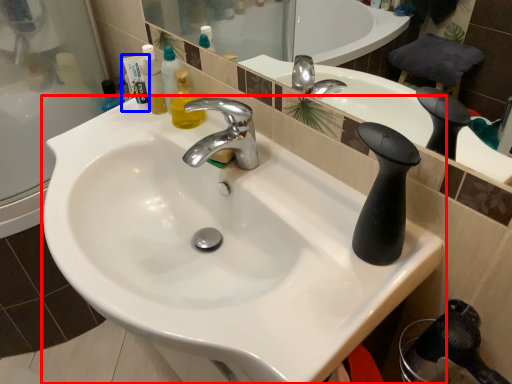
Question: Which object is closer to the camera taking this photo, sink (highlighted by a red box) or toiletry (highlighted by a blue box)?

Choices:
 (A) sink
 (B) toiletry

Answer: (A)